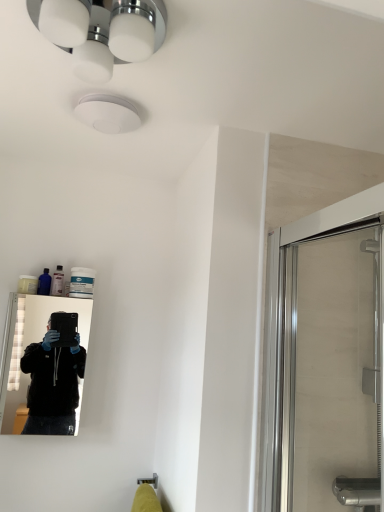
Question: Can you confirm if white glossy light fixture at upper center is shorter than black glossy mirror at left?

Choices:
 (A) yes
 (B) no

Answer: (A)

Question: Can you confirm if white glossy light fixture at upper center is positioned to the right of black glossy mirror at left?

Choices:
 (A) yes
 (B) no

Answer: (A)

Question: Is white glossy light fixture at upper center smaller than black glossy mirror at left?

Choices:
 (A) yes
 (B) no

Answer: (A)

Question: Is white glossy light fixture at upper center in contact with black glossy mirror at left?

Choices:
 (A) no
 (B) yes

Answer: (A)

Question: Can you confirm if white glossy light fixture at upper center is positioned to the left of black glossy mirror at left?

Choices:
 (A) yes
 (B) no

Answer: (B)

Question: Considering the relative positions of black glossy mirror at left and translucent plastic bottle at upper left in the image provided, is black glossy mirror at left to the left or to the right of translucent plastic bottle at upper left?

Choices:
 (A) left
 (B) right

Answer: (A)

Question: Is black glossy mirror at left taller or shorter than translucent plastic bottle at upper left?

Choices:
 (A) tall
 (B) short

Answer: (A)

Question: Considering the positions of point (33, 306) and point (56, 274), is point (33, 306) closer or farther from the camera than point (56, 274)?

Choices:
 (A) closer
 (B) farther

Answer: (A)

Question: From the image's perspective, relative to translucent plastic bottle at upper left, is black glossy mirror at left above or below?

Choices:
 (A) below
 (B) above

Answer: (A)

Question: In the image, is white glossy light fixture at upper center positioned in front of or behind translucent plastic bottle at upper left?

Choices:
 (A) front
 (B) behind

Answer: (A)

Question: Is white glossy light fixture at upper center wider or thinner than translucent plastic bottle at upper left?

Choices:
 (A) wide
 (B) thin

Answer: (A)

Question: From a real-world perspective, is white glossy light fixture at upper center above or below translucent plastic bottle at upper left?

Choices:
 (A) below
 (B) above

Answer: (B)

Question: Does point (84, 74) appear closer or farther from the camera than point (59, 290)?

Choices:
 (A) farther
 (B) closer

Answer: (B)

Question: In the image, is black glossy mirror at left positioned in front of or behind transparent glass shower door at right?

Choices:
 (A) behind
 (B) front

Answer: (A)

Question: Would you say black glossy mirror at left is inside or outside transparent glass shower door at right?

Choices:
 (A) outside
 (B) inside

Answer: (A)